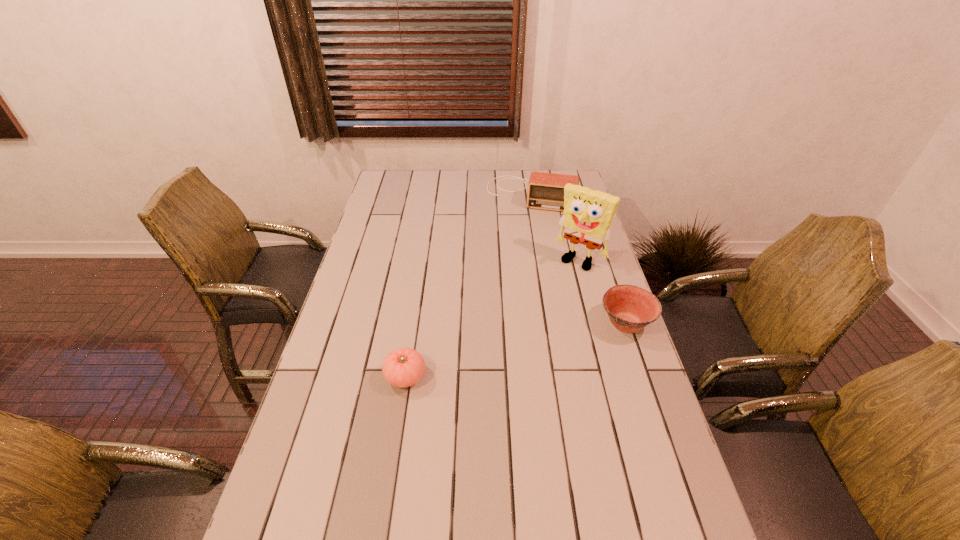
What are the coordinates of `the nearest object` in the screenshot? It's located at (403, 367).

At what (x,y) coordinates should I click in order to perform the action: click on the leftmost object. Please return your answer as a coordinate pair (x, y). This screenshot has width=960, height=540. Looking at the image, I should click on pyautogui.click(x=403, y=367).

Locate an element on the screen. This screenshot has width=960, height=540. the third farthest object is located at coordinates (630, 308).

Where is `radio receiver`? This screenshot has width=960, height=540. radio receiver is located at coordinates (545, 190).

At what (x,y) coordinates should I click in order to perform the action: click on the second tallest object. Please return your answer as a coordinate pair (x, y). Looking at the image, I should click on (545, 190).

Locate an element on the screen. sponge is located at coordinates (588, 214).

Where is `the third nearest object`? The height and width of the screenshot is (540, 960). the third nearest object is located at coordinates pyautogui.click(x=588, y=214).

Where is `vacant space located on the right of the tomato`? vacant space located on the right of the tomato is located at coordinates (507, 376).

At what (x,y) coordinates should I click in order to perform the action: click on free space located 0.200m on the left of the third farthest object. Please return your answer as a coordinate pair (x, y). The height and width of the screenshot is (540, 960). Looking at the image, I should click on (532, 323).

Locate an element on the screen. free point located on the front-facing side of the farthest object is located at coordinates (517, 242).